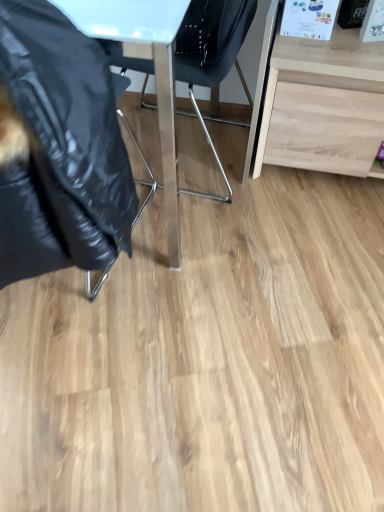
Question: From the image's perspective, is light wood desk at right positioned above or below black glossy jacket at left, the first chair in the left-to-right sequence?

Choices:
 (A) below
 (B) above

Answer: (B)

Question: Considering the positions of point (342, 74) and point (99, 211), is point (342, 74) closer or farther from the camera than point (99, 211)?

Choices:
 (A) farther
 (B) closer

Answer: (A)

Question: Estimate the real-world distances between objects in this image. Which object is farther from the metallic blue chair at center, placed as the first chair when sorted from right to left?

Choices:
 (A) black glossy jacket at left, which ranks as the 2th chair in right-to-left order
 (B) light wood desk at right

Answer: (A)

Question: Considering the real-world distances, which object is farthest from the light wood desk at right?

Choices:
 (A) metallic blue chair at center, placed as the first chair when sorted from right to left
 (B) black glossy jacket at left, which ranks as the 2th chair in right-to-left order

Answer: (B)